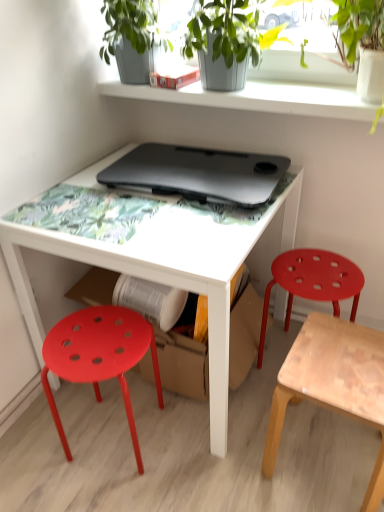
Locate an element on the screen. The image size is (384, 512). vacant space that is in between matte plastic stool at lower left, the 1th stool from the left, and white glossy table at center is located at coordinates (125, 443).